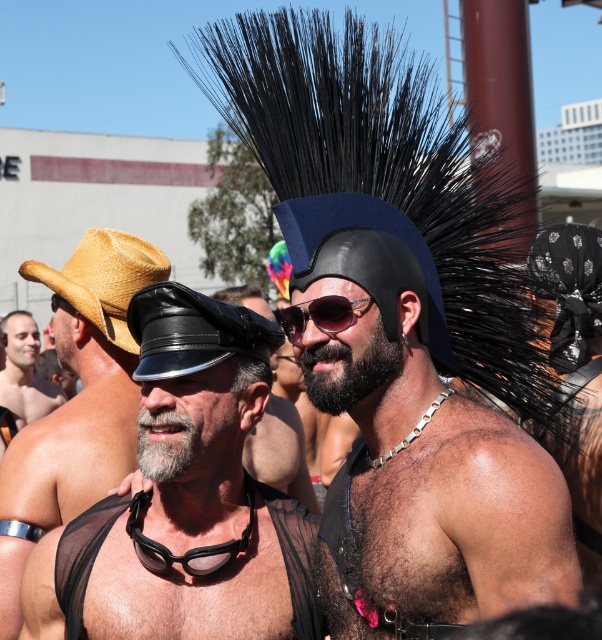
Between point (193, 563) and point (290, 324), which one is positioned in front?

Positioned in front is point (290, 324).

Looking at this image, which of these two, black rubber goggles at center or sunglassestransparent at center, stands shorter?

sunglassestransparent at center is shorter.

Locate an element on the screen. This screenshot has width=602, height=640. black rubber goggles at center is located at coordinates (188, 548).

Measure the distance from matte black hat at left to sunglassestransparent at center.

matte black hat at left is 1.23 meters away from sunglassestransparent at center.

Which is in front, point (101, 305) or point (294, 323)?

Point (294, 323) is more forward.

Does point (84, 285) come in front of point (327, 328)?

No, (84, 285) is behind (327, 328).

Where is `matte black hat at left`? matte black hat at left is located at coordinates (84, 381).

Who is lower down, black fuzzy beard at center or sunglassestransparent at center?

black fuzzy beard at center is below.

Identify the location of black fuzzy beard at center. The height and width of the screenshot is (640, 602). (349, 371).